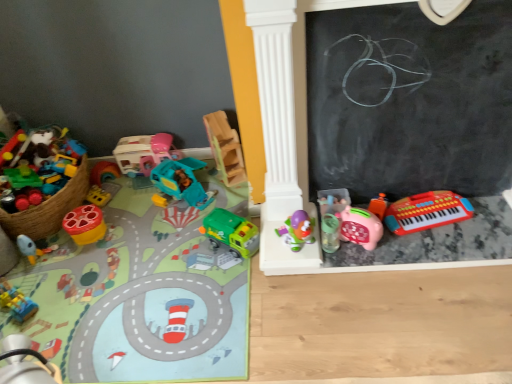
In order to click on unoccupied space behind matte plastic toy rocket at lower left, which is the 12th toy from right to left in this screenshot , I will do `click(52, 241)`.